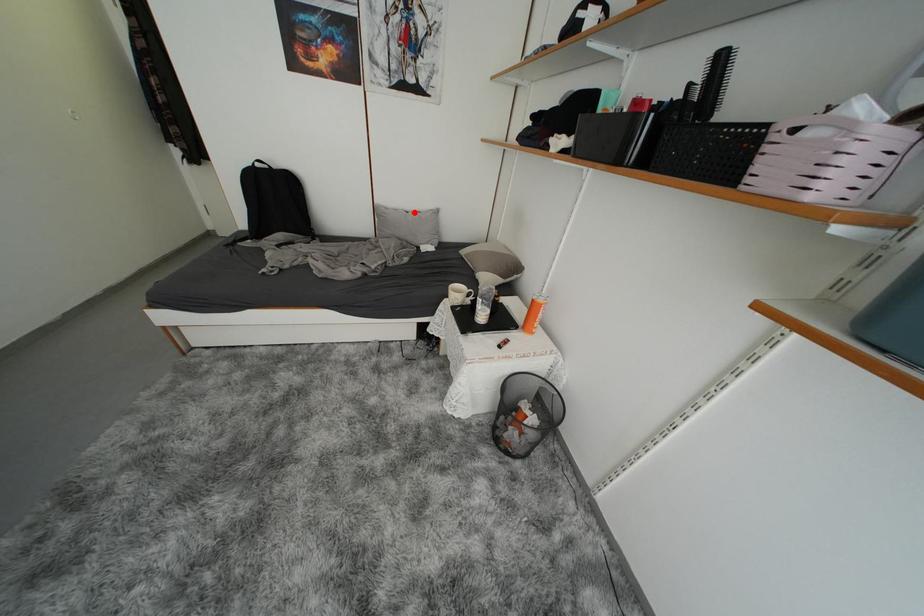
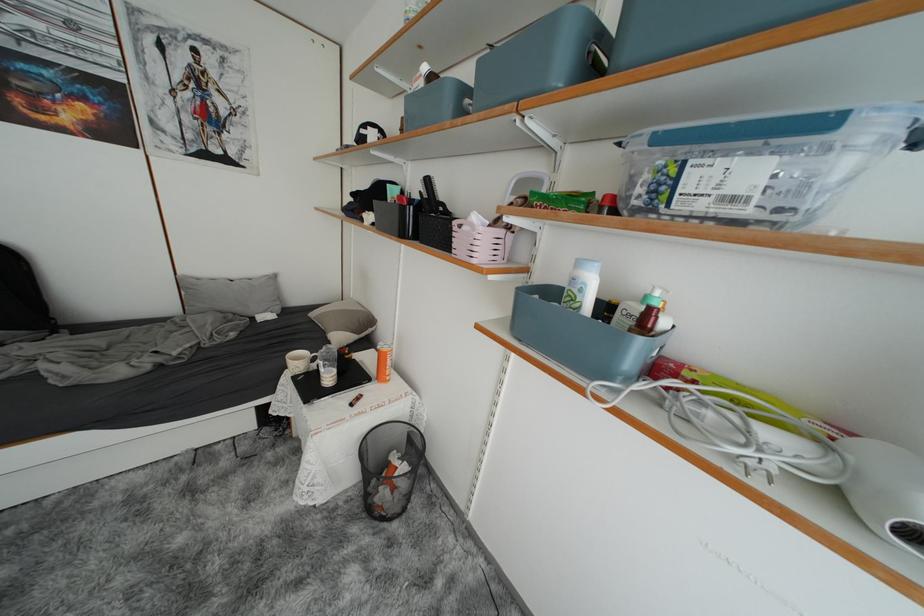
Where in the second image is the point corresponding to the highlighted location from the first image?

(238, 281)